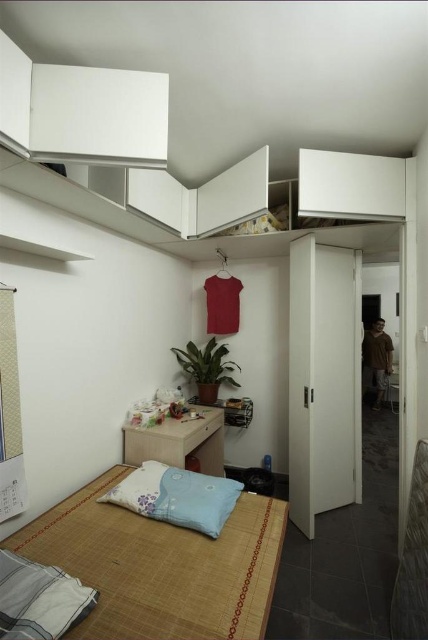
You are standing at the entrance of the studio apartment and see two points marked on the floor. The first point is labeled as point (131, 474) and the second is point (74, 604). Which point is closer to the entrance?

Point (74, 604) is closer to the entrance because it is in front of point (131, 474), which is behind it.

You are trying to place a rectangular storage box that measures 25 centimeters in length between the bamboo mat bed at lower left and the blue fabric pillow at lower left. Will the box fit in the space between them?

The bamboo mat bed at lower left and blue fabric pillow at lower left are 24.95 centimeters apart. Since the storage box is 25 centimeters long, it will not fit in the space between them as the distance is slightly less than the box length.